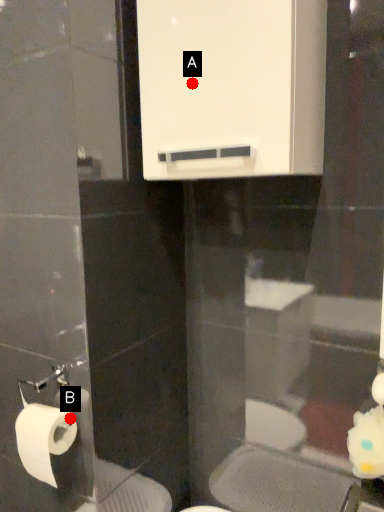
Question: Two points are circled on the image, labeled by A and B beside each circle. Among these points, which one is nearest to the camera?

Choices:
 (A) A is closer
 (B) B is closer

Answer: (A)